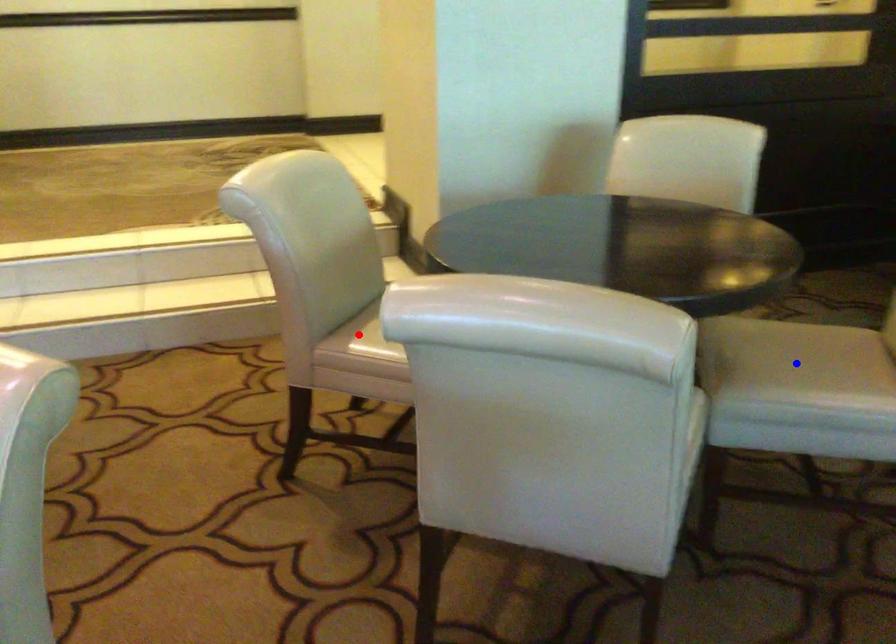
Question: Which of the two points in the image is closer to the camera?

Choices:
 (A) Blue point is closer.
 (B) Red point is closer.

Answer: (A)